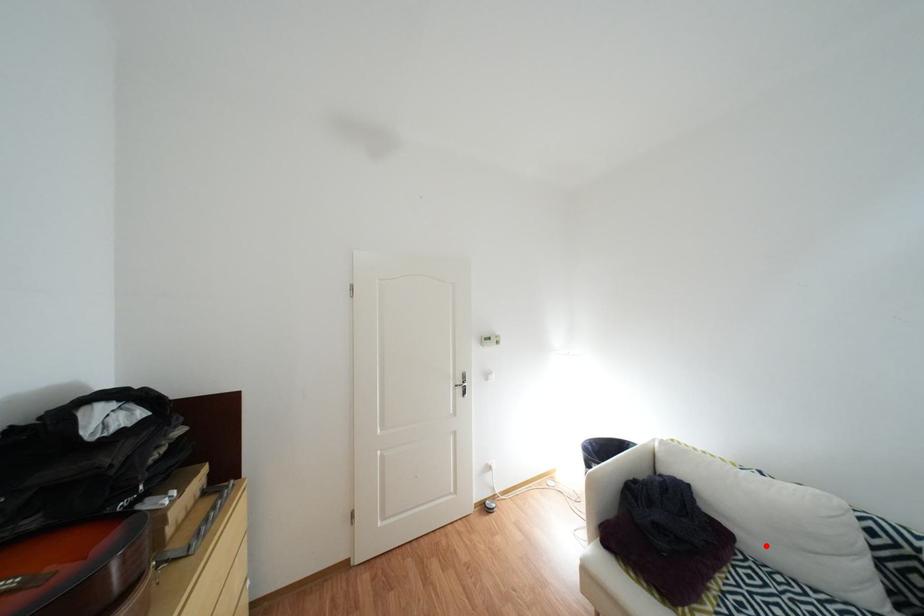
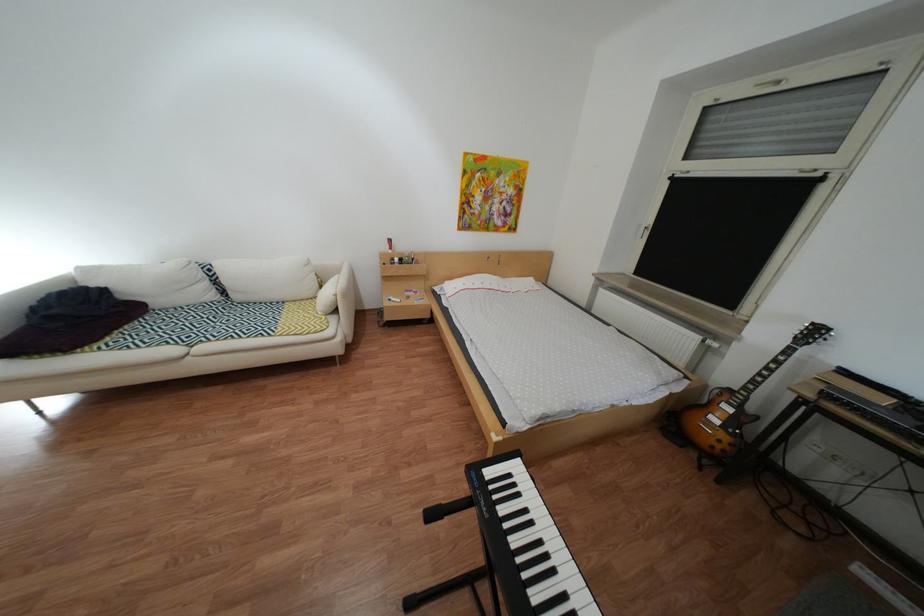
Where in the second image is the point corresponding to the highlighted location from the first image?

(172, 304)